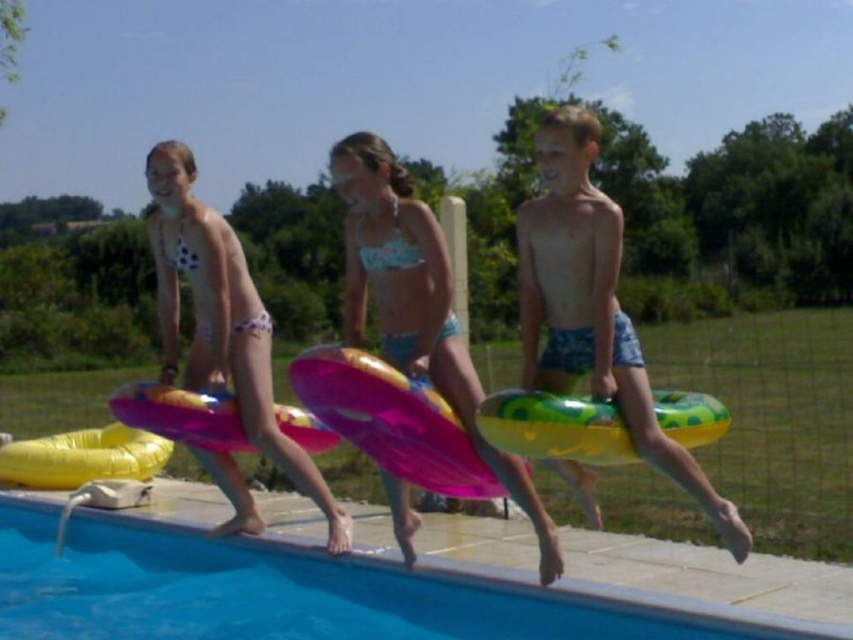
In the image, there are three children jumping into a pool. Two girls are wearing bikinis and one boy is shirtless. The first girl has a patterned top, the second girl has a light blue bikini, and the boy has blue swim trunks. Each holds an inflatable ring. If you were to draw a point at coordinates (416, 305) on the image, which child would that point correspond to?

The point at coordinates (416, 305) corresponds to the light blue bikini at center.

You are a photographer trying to capture the children jumping into the pool. You notice the blue smooth water at lower center and the white polka dot bikini at center. Which object is positioned lower in the image?

The blue smooth water at lower center is located below the white polka dot bikini at center, so it is positioned lower in the image.

You are standing at the point labeled as point (585, 337) and want to throw a ball to a friend who is 5 meters away from you. Is the friend standing at the same location as the viewer?

The point (585, 337) is 5.05 meters away from the viewer. Since the friend is 5 meters away, they are approximately at the same location as the viewer.